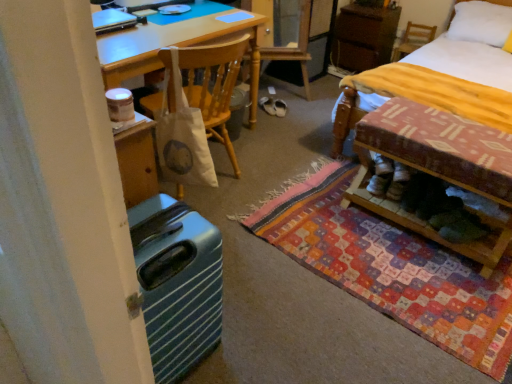
Image resolution: width=512 pixels, height=384 pixels. I want to click on free location in front of white fabric shoe at center, marked as the first footwear in a left-to-right arrangement, so 275,119.